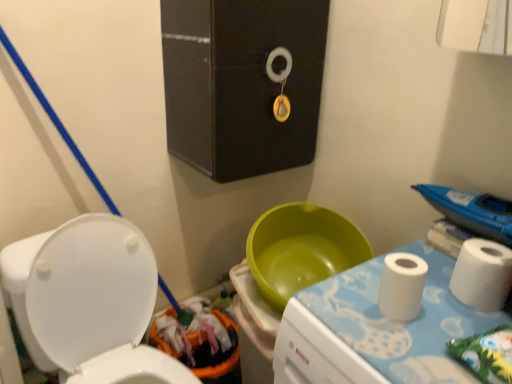
Where is `vacant space to the right of white matte toilet paper at right`? vacant space to the right of white matte toilet paper at right is located at coordinates (441, 307).